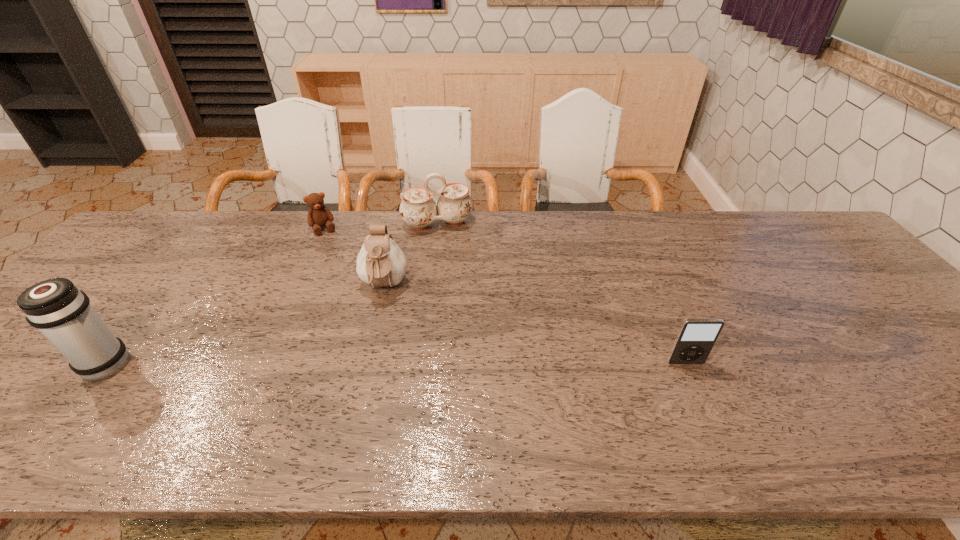
Find the location of a particular element. The width and height of the screenshot is (960, 540). free space located 0.180m by the handle of the chinaware is located at coordinates (454, 271).

This screenshot has width=960, height=540. What are the coordinates of `teddy bear that is at the far edge` in the screenshot? It's located at (319, 215).

I want to click on chinaware situated at the far edge, so click(418, 209).

You are a GUI agent. You are given a task and a screenshot of the screen. Output one action in this format:
    pyautogui.click(x=<x>, y=<y>)
    Task: Click on the object located at the near edge
    This screenshot has width=960, height=540.
    Given the screenshot: What is the action you would take?
    click(x=60, y=311)

In the image, there is a desktop. At what (x,y) coordinates should I click in order to perform the action: click on blank space at the far edge. Please return your answer as a coordinate pair (x, y). This screenshot has width=960, height=540. Looking at the image, I should click on (365, 226).

This screenshot has width=960, height=540. In order to click on free region at the near edge in this screenshot , I will do `click(516, 396)`.

Image resolution: width=960 pixels, height=540 pixels. In order to click on vacant space at the left edge of the desktop in this screenshot , I will do `click(98, 305)`.

Locate an element on the screen. vacant area at the right edge is located at coordinates (887, 349).

Locate an element on the screen. The image size is (960, 540). free space at the near right corner of the desktop is located at coordinates (950, 383).

This screenshot has width=960, height=540. I want to click on vacant space that is in between the chinaware and the thermos bottle, so click(270, 294).